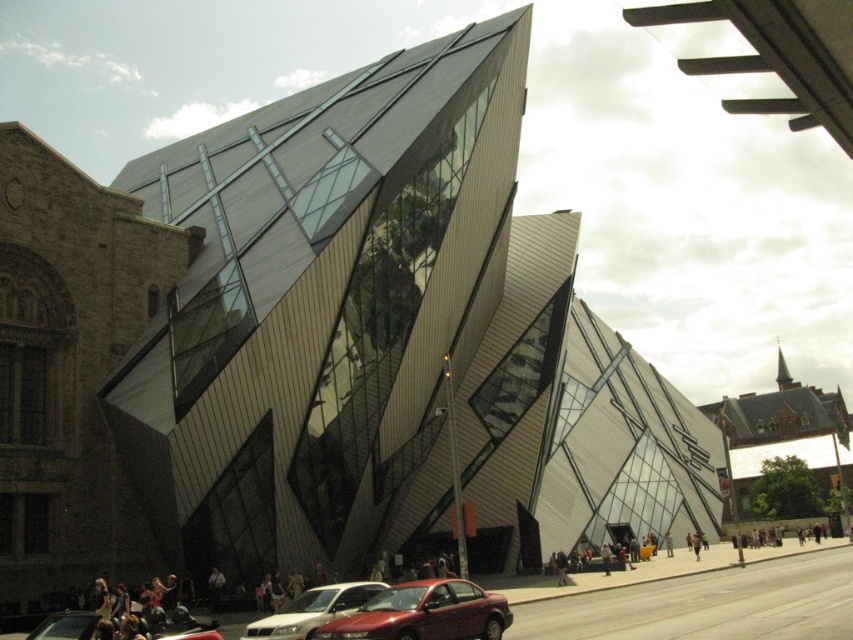
From the picture: You are a delivery driver trying to park your shiny red sedan at center in a parking spot that can only accommodate vehicles smaller than it. There is a metallic red car at lower center already parked nearby. Can your vehicle fit in the spot?

The shiny red sedan at center is bigger than the metallic red car at lower center. Since the parking spot can only accommodate vehicles smaller than your shiny red sedan at center, your vehicle cannot fit in the spot.

You are standing on the sidewalk in front of the modern building and want to take a photo of the matte white sedan at lower center. If your camera has a maximum zoom range of 40 meters, will you be able to capture the entire sedan in the photo without moving closer?

The distance between you and the matte white sedan at lower center is 41.83 meters, which exceeds the camera maximum zoom range of 40 meters. Therefore, you won not be able to capture the entire sedan in the photo without moving closer.